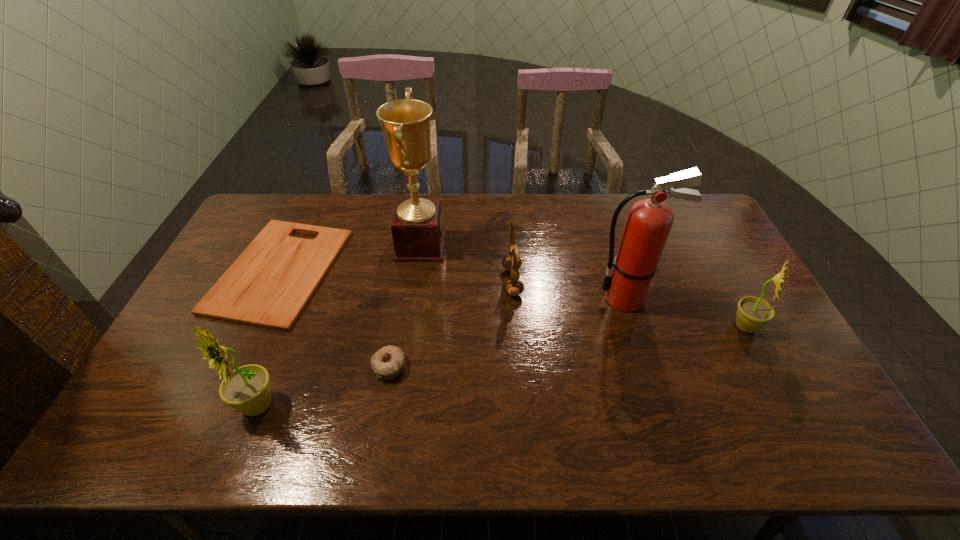
If the aim is uniform spacing by inserting an additional sunflower among them, please point to a vacant space for this new sunflower. Please provide its 2D coordinates. Your answer should be formatted as a tuple, i.e. [(x, y)], where the tuple contains the x and y coordinates of a point satisfying the conditions above.

[(519, 363)]